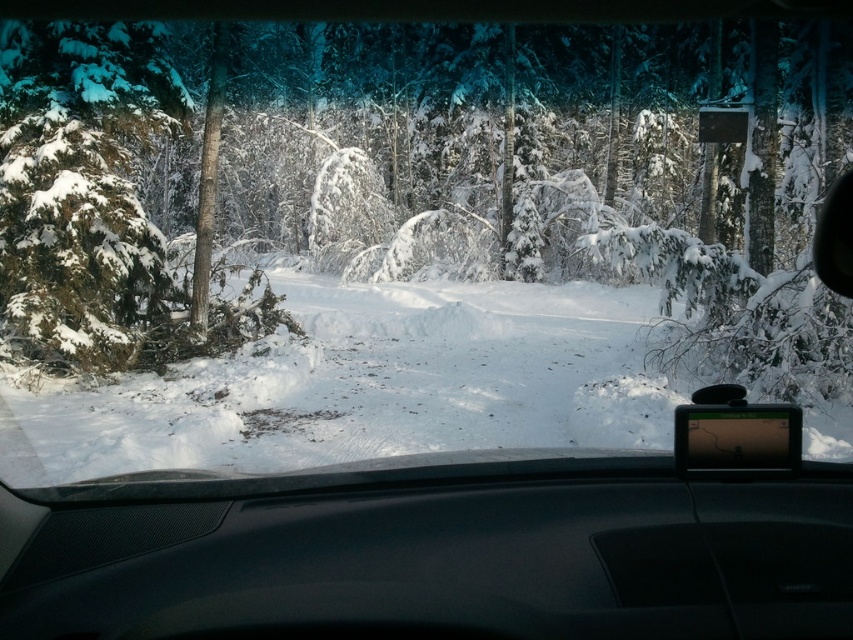
Question: From the image, what is the correct spatial relationship of black matte dashboard at center in relation to white fluffy snow at center?

Choices:
 (A) below
 (B) above

Answer: (A)

Question: Is black matte dashboard at center wider than white fluffy snow at center?

Choices:
 (A) no
 (B) yes

Answer: (A)

Question: Which object appears farthest from the camera in this image?

Choices:
 (A) black matte dashboard at center
 (B) white fluffy snow at center

Answer: (B)

Question: Is black matte dashboard at center above white fluffy snow at center?

Choices:
 (A) yes
 (B) no

Answer: (B)

Question: Which point is closer to the camera taking this photo?

Choices:
 (A) (370, 420)
 (B) (207, 598)

Answer: (B)